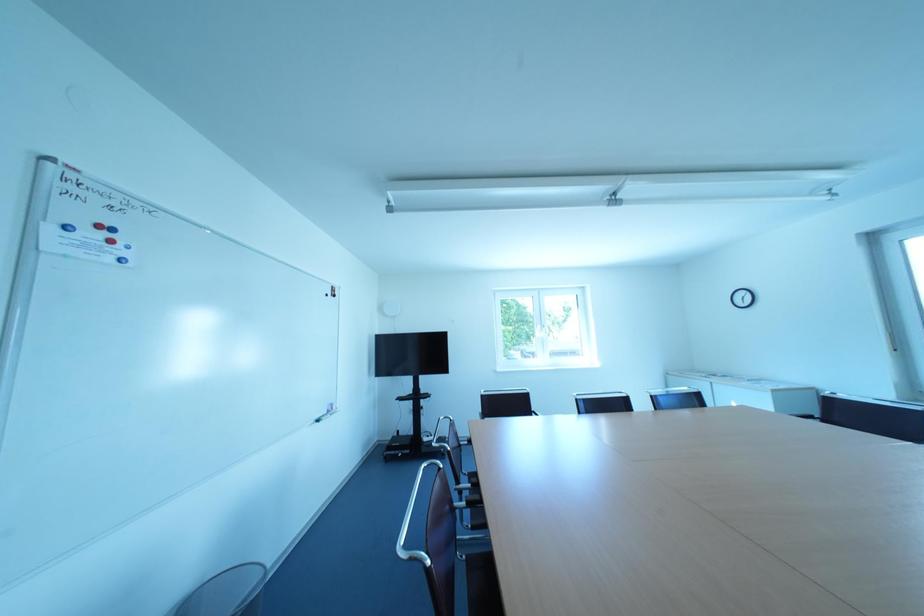
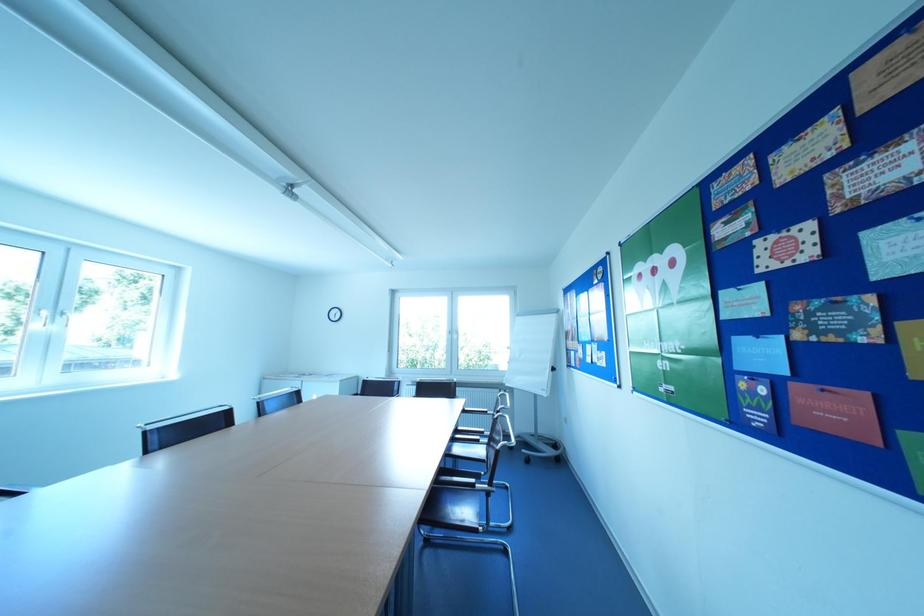
Question: The first image is from the beginning of the video and the second image is from the end. How did the camera likely rotate when shooting the video?

Choices:
 (A) Left
 (B) Right
 (C) Up
 (D) Down

Answer: (B)